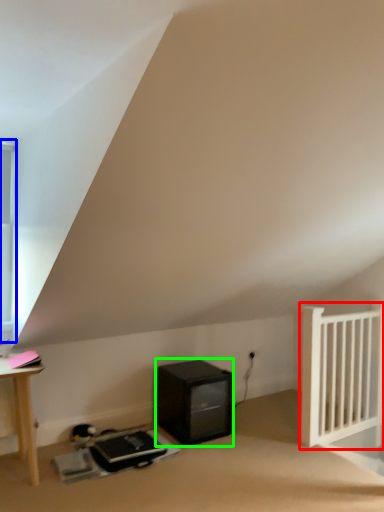
Question: Which object is the closest to the radiator (highlighted by a red box)? Choose among these: window (highlighted by a blue box) or appliance (highlighted by a green box).

Choices:
 (A) window
 (B) appliance

Answer: (B)